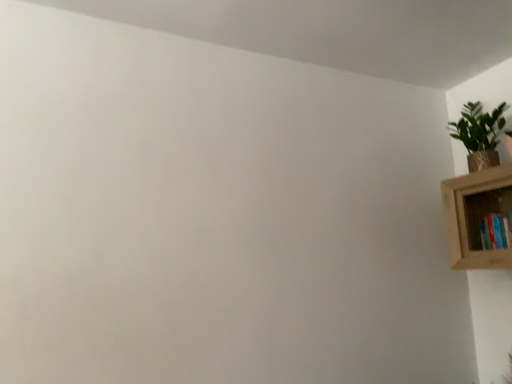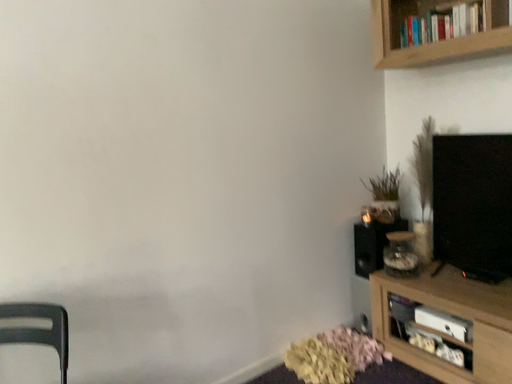
Question: How did the camera likely rotate when shooting the video?

Choices:
 (A) rotated right
 (B) rotated left

Answer: (A)